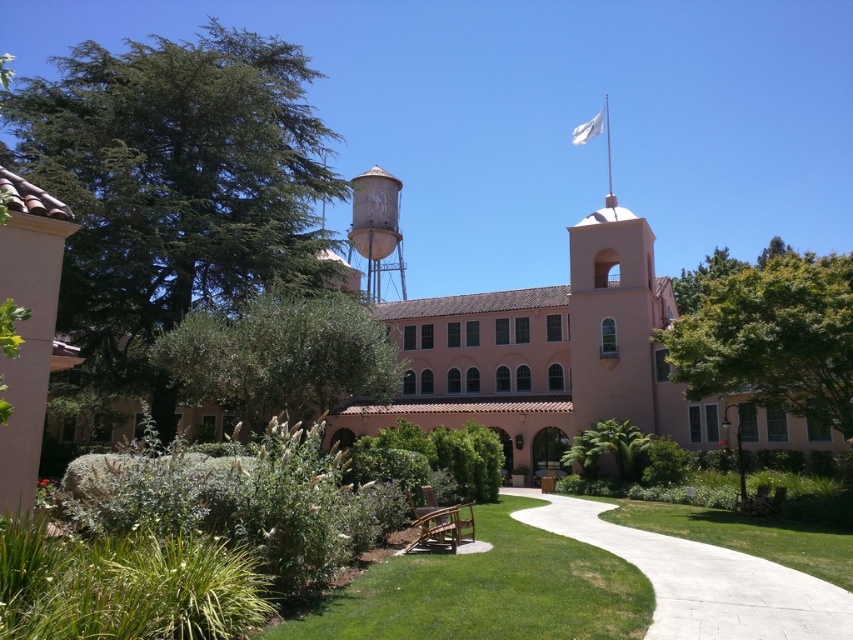
Question: Considering the real-world distances, which object is closest to the white fabric flag at upper center?

Choices:
 (A) green grass at lower center
 (B) white concrete path at lower center
 (C) brown wooden park bench at center
 (D) rustic metal water tower at center

Answer: (D)

Question: Which of the following is the closest to the observer?

Choices:
 (A) brown wooden park bench at center
 (B) green leafy tree at right
 (C) rustic metal water tower at center
 (D) white concrete path at lower center

Answer: (D)

Question: Is the position of green leafy tree at left more distant than that of white fabric flag at upper center?

Choices:
 (A) no
 (B) yes

Answer: (A)

Question: Does green leafy tree at left lie in front of green grass at lower center?

Choices:
 (A) yes
 (B) no

Answer: (B)

Question: Considering the real-world distances, which object is farthest from the white fabric flag at upper center?

Choices:
 (A) rustic metal water tower at center
 (B) green leafy tree at right
 (C) white concrete path at lower center

Answer: (C)

Question: Can you confirm if green leafy bush at center is wider than brown wooden park bench at center?

Choices:
 (A) yes
 (B) no

Answer: (A)